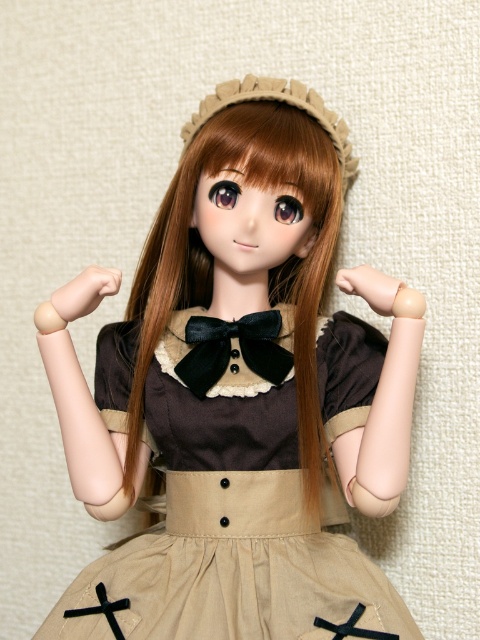
Is point (181, 241) closer to camera compared to point (245, 349)?

That is False.

The height and width of the screenshot is (640, 480). Find the location of `brown silky hair at center`. brown silky hair at center is located at coordinates (268, 269).

The height and width of the screenshot is (640, 480). Describe the element at coordinates (268, 269) in the screenshot. I see `brown silky hair at center` at that location.

You are a GUI agent. You are given a task and a screenshot of the screen. Output one action in this format:
    pyautogui.click(x=<x>, y=<y>)
    Task: Click on the brown silky hair at center
    The image size is (480, 640).
    Given the screenshot: What is the action you would take?
    pyautogui.click(x=268, y=269)

Does matte brown dress at center have a lesser height compared to black satin bow tie at center?

Incorrect, matte brown dress at center's height does not fall short of black satin bow tie at center's.

Image resolution: width=480 pixels, height=640 pixels. Describe the element at coordinates (237, 397) in the screenshot. I see `matte brown dress at center` at that location.

Does point (226, 534) come in front of point (266, 317)?

Yes, it is.

Locate an element on the screen. matte brown dress at center is located at coordinates (237, 397).

Does matte brown dress at center appear under brown silky hair at center?

Yes.

I want to click on matte brown dress at center, so click(237, 397).

Between point (392, 369) and point (284, 275), which one is positioned behind?

Positioned behind is point (284, 275).

The height and width of the screenshot is (640, 480). Find the location of `matte brown dress at center`. matte brown dress at center is located at coordinates (237, 397).